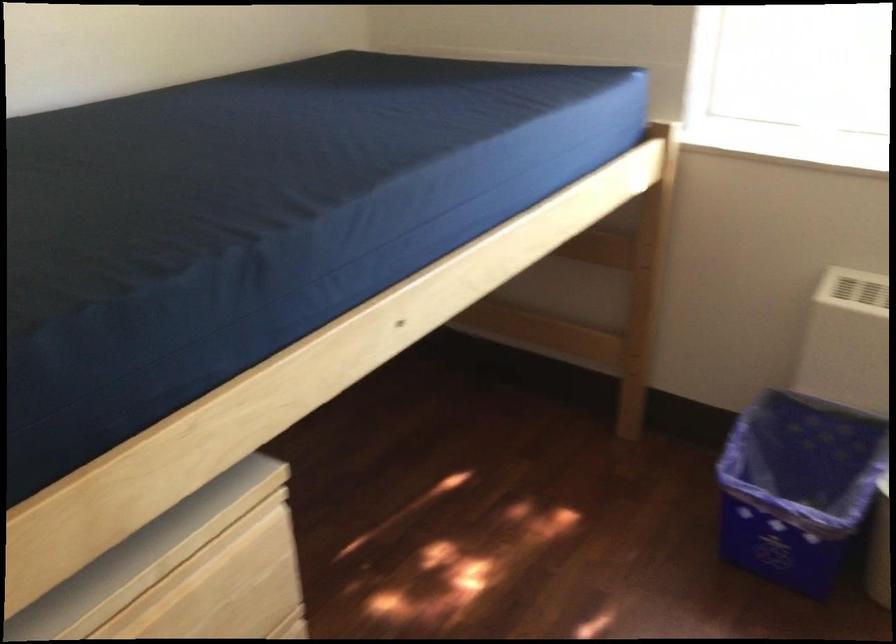
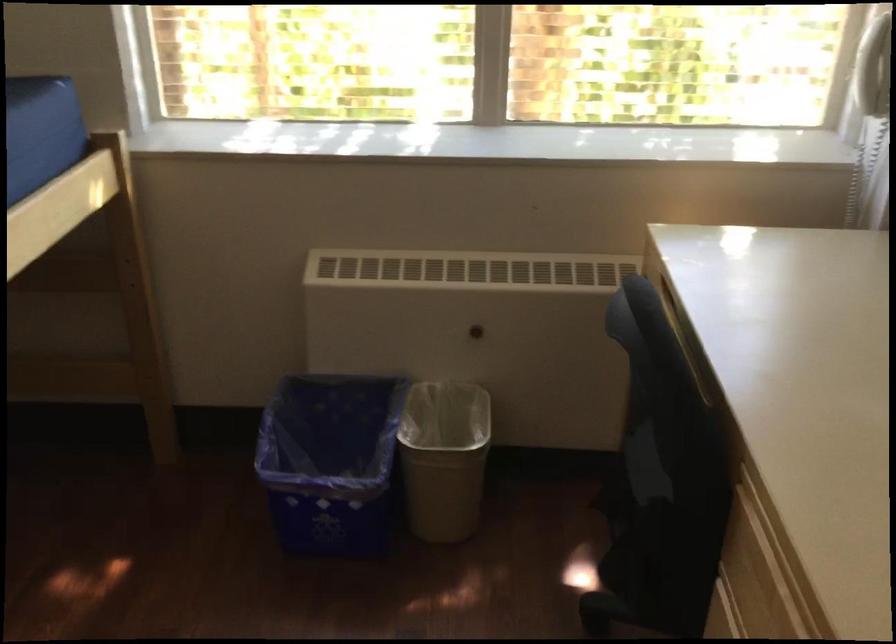
Question: The camera is either moving clockwise (left) or counter-clockwise (right) around the object. The first image is from the beginning of the video and the second image is from the end. Is the camera moving left or right when shooting the video?

Choices:
 (A) Left
 (B) Right

Answer: (A)